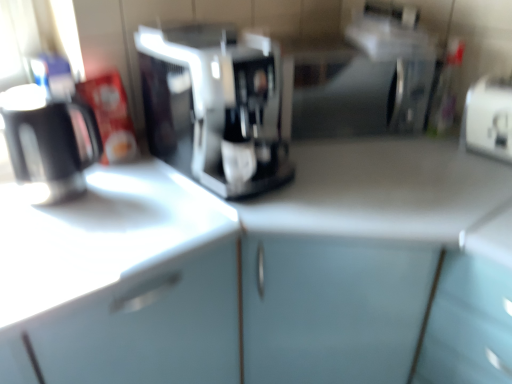
You are a GUI agent. You are given a task and a screenshot of the screen. Output one action in this format:
    pyautogui.click(x=<x>, y=<y>)
    Task: Click on the free space in front of matte black mug at left
    
    Given the screenshot: What is the action you would take?
    pyautogui.click(x=50, y=224)